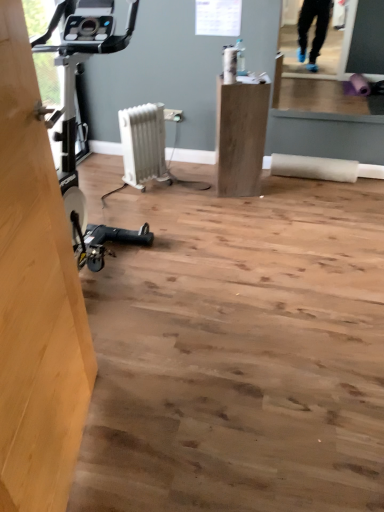
The height and width of the screenshot is (512, 384). Find the location of `vacant space situated above matte wood cabinet at center (from a real-world perspective)`. vacant space situated above matte wood cabinet at center (from a real-world perspective) is located at coordinates (242, 78).